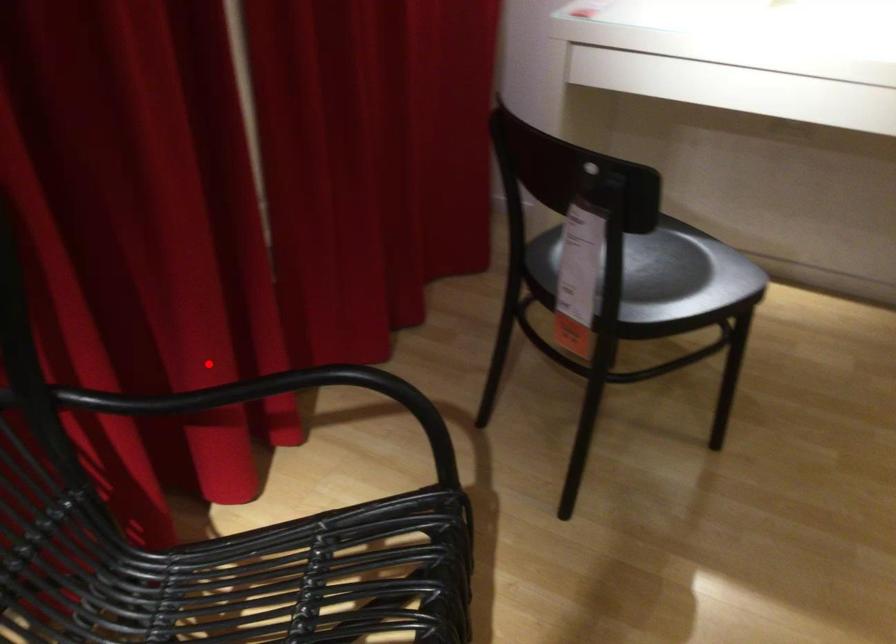
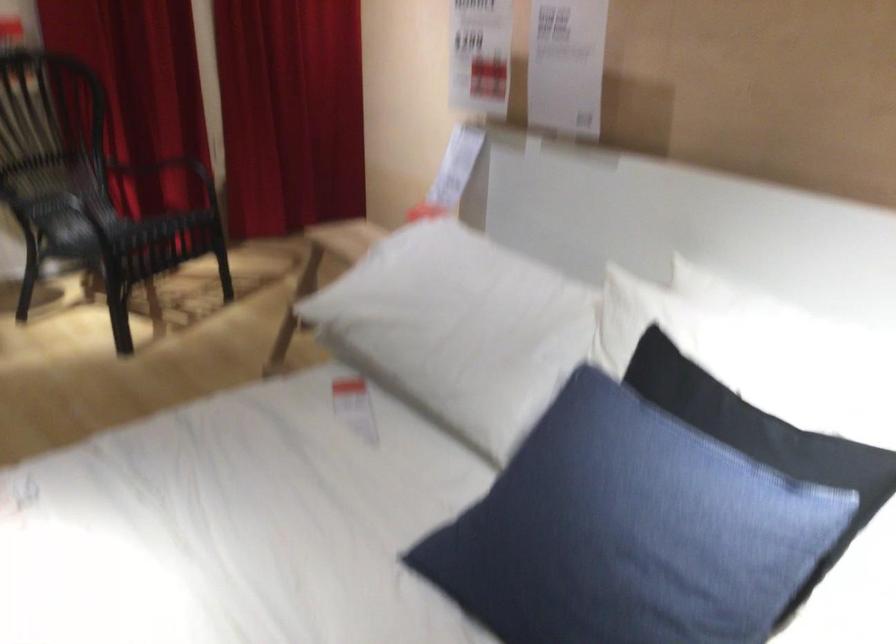
Find the pixel in the second image that matches the highlighted location in the first image.

(176, 169)